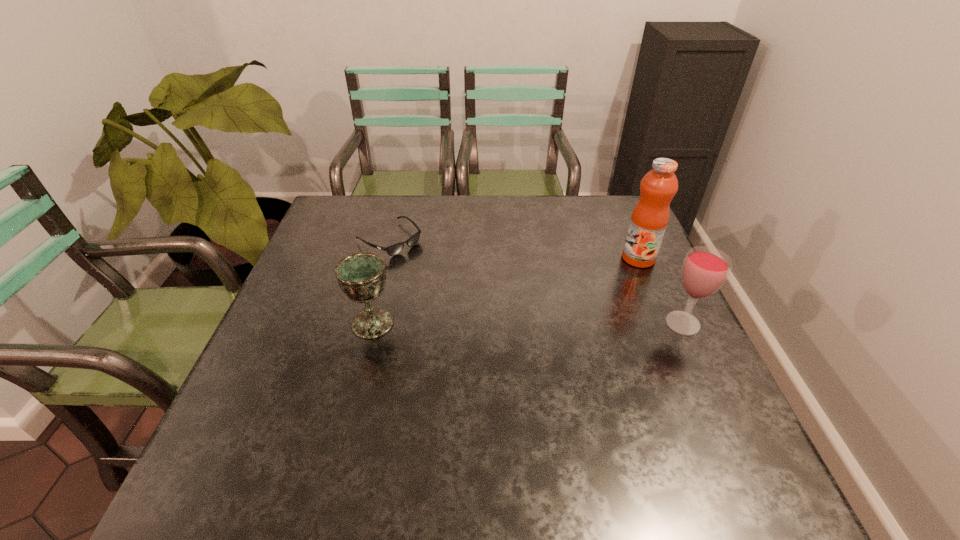
Locate an element on the screen. This screenshot has height=540, width=960. vacant space at the right edge is located at coordinates (659, 376).

Locate an element on the screen. This screenshot has height=540, width=960. free space at the far right corner is located at coordinates (605, 196).

Identify the location of empty space that is in between the fruit juice and the sunglasses. The image size is (960, 540). (514, 249).

Find the location of a particular element. The image size is (960, 540). free space between the sunglasses and the wineglass is located at coordinates (537, 281).

Find the location of a particular element. Image resolution: width=960 pixels, height=540 pixels. free area in between the wineglass and the chalice is located at coordinates (528, 323).

Where is `vacant space in between the sunglasses and the tallest object`? This screenshot has height=540, width=960. vacant space in between the sunglasses and the tallest object is located at coordinates (514, 249).

Locate an element on the screen. free point between the wineglass and the fruit juice is located at coordinates (660, 291).

This screenshot has width=960, height=540. I want to click on free space between the wineglass and the chalice, so click(x=528, y=323).

The height and width of the screenshot is (540, 960). I want to click on vacant region between the chalice and the wineglass, so click(x=528, y=323).

You are a GUI agent. You are given a task and a screenshot of the screen. Output one action in this format:
    pyautogui.click(x=<x>, y=<y>)
    Task: Click on the empty space that is in between the shortest object and the tallest object
    
    Given the screenshot: What is the action you would take?
    pyautogui.click(x=514, y=249)